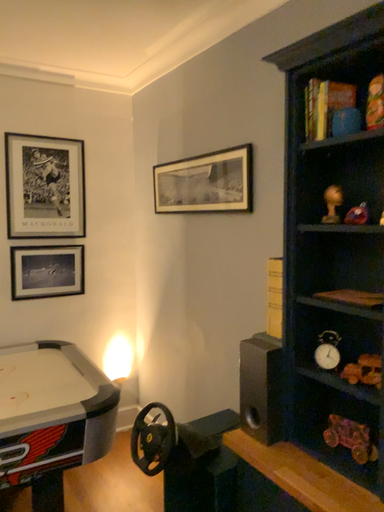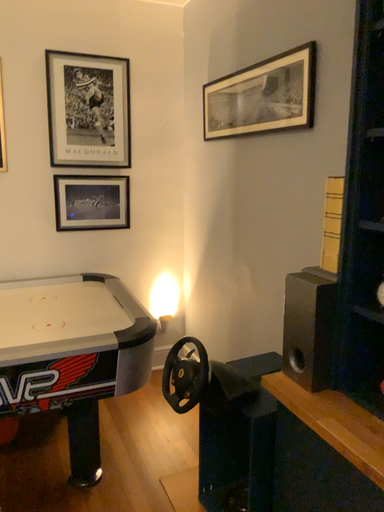
Question: How did the camera likely rotate when shooting the video?

Choices:
 (A) rotated right
 (B) rotated left

Answer: (B)